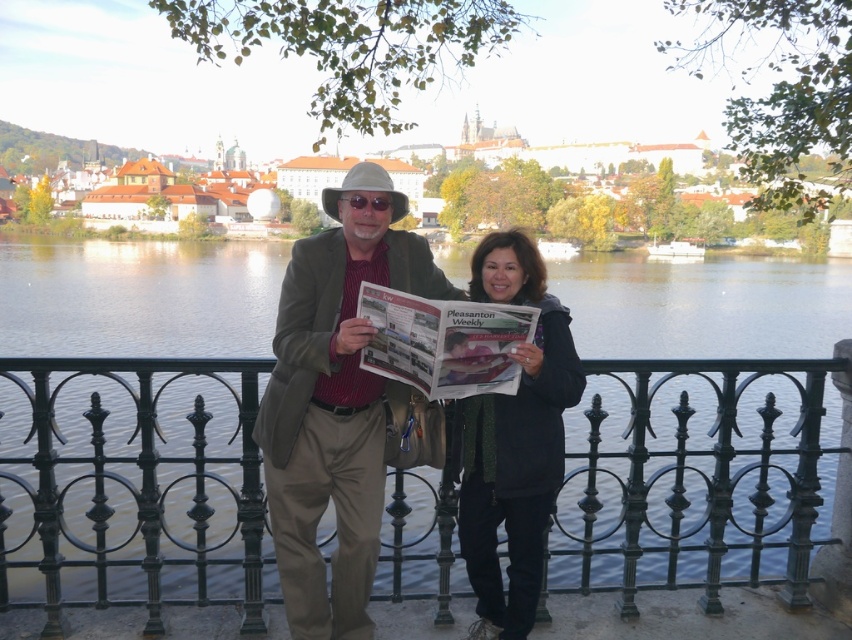
Is black wrought iron railing at center above dark gray jacket at center?

Yes.

Which is more to the left, black wrought iron railing at center or dark gray jacket at center?

From the viewer's perspective, black wrought iron railing at center appears more on the left side.

Locate an element on the screen. The image size is (852, 640). black wrought iron railing at center is located at coordinates (x=131, y=484).

Which is behind, point (348, 401) or point (527, 621)?

Point (348, 401)

Based on the photo, is the position of khaki cotton pants at center more distant than that of dark gray jacket at center?

No, khaki cotton pants at center is in front of dark gray jacket at center.

Is point (360, 230) closer to viewer compared to point (501, 596)?

No, (360, 230) is behind (501, 596).

Where is `khaki cotton pants at center`? khaki cotton pants at center is located at coordinates (340, 403).

The height and width of the screenshot is (640, 852). What do you see at coordinates (131, 484) in the screenshot?
I see `black wrought iron railing at center` at bounding box center [131, 484].

Can you confirm if black wrought iron railing at center is positioned below khaki cotton pants at center?

Yes, black wrought iron railing at center is below khaki cotton pants at center.

This screenshot has height=640, width=852. What are the coordinates of `black wrought iron railing at center` in the screenshot? It's located at (131, 484).